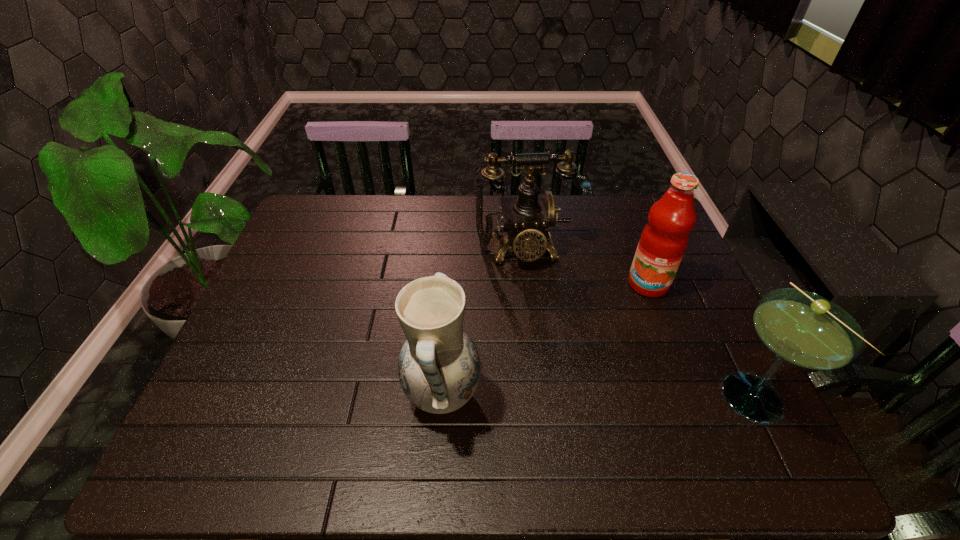
Locate an element on the screen. This screenshot has height=540, width=960. vacant area that lies between the pottery and the telephone is located at coordinates (481, 323).

Identify the location of vacant area between the telephone and the martini. Image resolution: width=960 pixels, height=540 pixels. (636, 323).

Image resolution: width=960 pixels, height=540 pixels. What are the coordinates of `vacant space that's between the fruit juice and the telephone` in the screenshot? It's located at (584, 267).

Image resolution: width=960 pixels, height=540 pixels. What are the coordinates of `free space that is in between the shortest object and the pottery` in the screenshot? It's located at (596, 395).

The width and height of the screenshot is (960, 540). In order to click on free space that is in between the telephone and the fruit juice in this screenshot , I will do `click(584, 267)`.

This screenshot has height=540, width=960. What are the coordinates of `free space between the telephone and the fruit juice` in the screenshot? It's located at (584, 267).

Image resolution: width=960 pixels, height=540 pixels. In order to click on blank region between the pottery and the fruit juice in this screenshot , I will do `click(545, 340)`.

The width and height of the screenshot is (960, 540). What are the coordinates of `free space that is in between the pottery and the telephone` in the screenshot? It's located at (481, 323).

The image size is (960, 540). In order to click on free spot between the pottery and the shortest object in this screenshot , I will do `click(596, 395)`.

Locate an element on the screen. free space between the shortest object and the telephone is located at coordinates (636, 323).